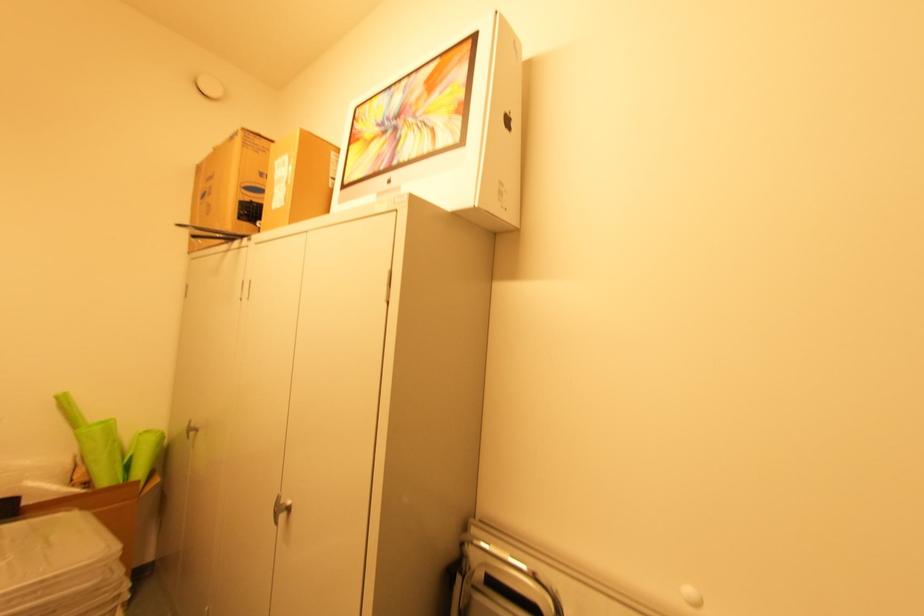
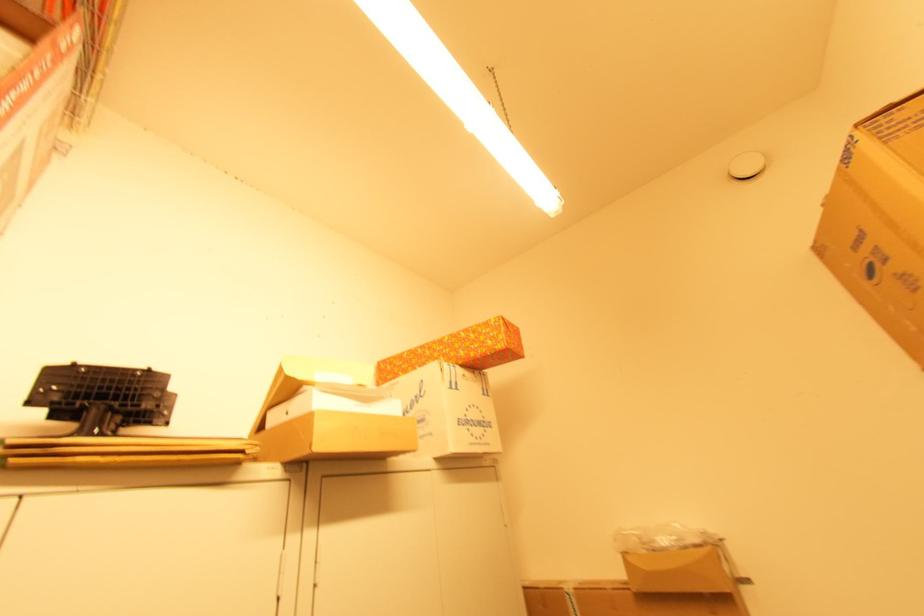
First-person continuous shooting, in which direction is the camera rotating?

The camera's rotation is toward left-up.